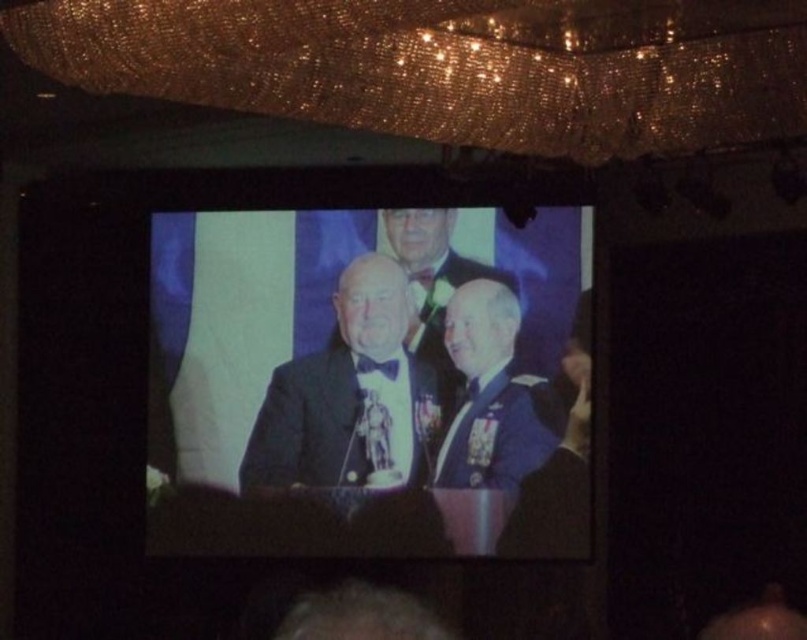
Is satin black suit at center above uniformed military officer at center?

Incorrect, satin black suit at center is not positioned above uniformed military officer at center.

Find the location of a particular element. Image resolution: width=807 pixels, height=640 pixels. satin black suit at center is located at coordinates (350, 396).

What do you see at coordinates (350, 396) in the screenshot?
I see `satin black suit at center` at bounding box center [350, 396].

The height and width of the screenshot is (640, 807). I want to click on satin black suit at center, so click(350, 396).

Who is positioned more to the right, black satin suit at center or satin black suit at center?

black satin suit at center

The height and width of the screenshot is (640, 807). I want to click on black satin suit at center, so pos(375,387).

Consider the image. Is satin black suit at center behind shiny blue suit at center?

No, it is not.

Does satin black suit at center have a greater width compared to shiny blue suit at center?

Yes, satin black suit at center is wider than shiny blue suit at center.

Find the location of a particular element. This screenshot has height=640, width=807. satin black suit at center is located at coordinates (350, 396).